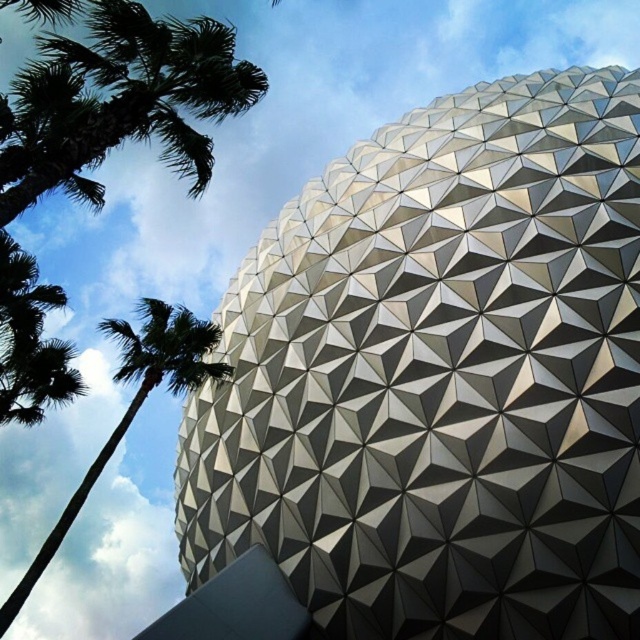
Can you confirm if green leafy palm tree at upper left is taller than green leafy palm tree at left?

Yes.

Is green leafy palm tree at upper left smaller than green leafy palm tree at left?

Incorrect, green leafy palm tree at upper left is not smaller in size than green leafy palm tree at left.

Who is more forward, (67,83) or (168,353)?

Positioned in front is point (67,83).

In order to click on green leafy palm tree at upper left in this screenshot , I will do `click(118, 100)`.